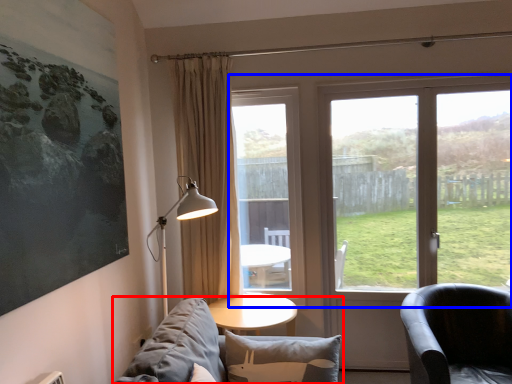
Question: Which point is closer to the camera, studio couch (highlighted by a red box) or window (highlighted by a blue box)?

Choices:
 (A) studio couch
 (B) window

Answer: (A)